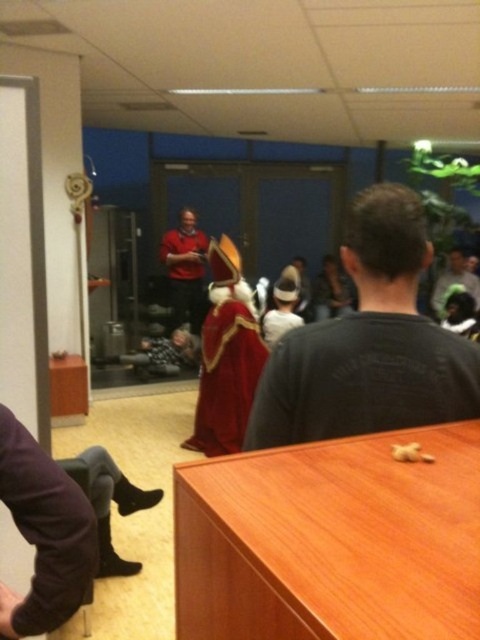
Can you confirm if velvet red cape at center is shorter than dark gray cotton shirt at upper right?

No, velvet red cape at center is not shorter than dark gray cotton shirt at upper right.

Is velvet red cape at center smaller than dark gray cotton shirt at upper right?

Yes, velvet red cape at center is smaller than dark gray cotton shirt at upper right.

Is point (197, 435) behind point (435, 304)?

No, (197, 435) is closer to viewer.

Locate an element on the screen. velvet red cape at center is located at coordinates (227, 371).

Can you confirm if black matte shirt at center is shorter than purple fabric pants at lower left?

No, black matte shirt at center is not shorter than purple fabric pants at lower left.

Who is higher up, black matte shirt at center or purple fabric pants at lower left?

Positioned higher is black matte shirt at center.

Is point (443, 339) in front of point (10, 596)?

No, it is behind (10, 596).

Where is `black matte shirt at center`? The height and width of the screenshot is (640, 480). black matte shirt at center is located at coordinates (x=369, y=342).

Does wooden table at center appear under matte red shirt at center?

Correct, wooden table at center is located below matte red shirt at center.

Can you confirm if wooden table at center is wider than matte red shirt at center?

Indeed, wooden table at center has a greater width compared to matte red shirt at center.

Where is `wooden table at center`? wooden table at center is located at coordinates (331, 540).